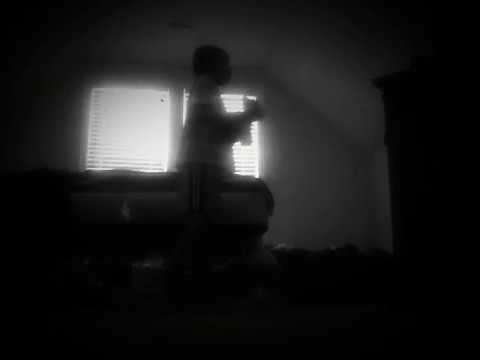
What are the coordinates of `window` in the screenshot? It's located at (124, 132), (244, 159).